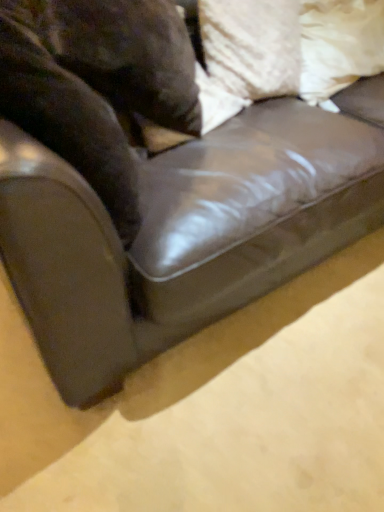
Find the location of a particular element. Image resolution: width=384 pixels, height=512 pixels. white fabric pillow at upper right, which is the first pillow in right-to-left order is located at coordinates click(x=339, y=45).

The height and width of the screenshot is (512, 384). What are the coordinates of `white fabric pillow at upper right, which is the first pillow in right-to-left order` in the screenshot? It's located at (339, 45).

From the image's perspective, is white fabric pillow at upper right, the 2th pillow when ordered from left to right, over white textured pillow at upper right, the 1th pillow when ordered from left to right?

Indeed, from the image's perspective, white fabric pillow at upper right, the 2th pillow when ordered from left to right, is shown above white textured pillow at upper right, the 1th pillow when ordered from left to right.

Can you confirm if white fabric pillow at upper right, the 2th pillow when ordered from left to right, is positioned to the left of white textured pillow at upper right, acting as the second pillow starting from the right?

In fact, white fabric pillow at upper right, the 2th pillow when ordered from left to right, is to the right of white textured pillow at upper right, acting as the second pillow starting from the right.

Does point (310, 59) lie behind point (209, 19)?

Yes, point (310, 59) is farther from viewer.

This screenshot has width=384, height=512. What are the coordinates of `pillow above the white textured pillow at upper right, acting as the second pillow starting from the right (from the image's perspective)` in the screenshot? It's located at (339, 45).

Considering the relative sizes of white textured pillow at upper right, the 1th pillow when ordered from left to right, and brown fur at left in the image provided, is white textured pillow at upper right, the 1th pillow when ordered from left to right, shorter than brown fur at left?

Yes.

Considering the relative sizes of white textured pillow at upper right, acting as the second pillow starting from the right, and brown fur at left in the image provided, is white textured pillow at upper right, acting as the second pillow starting from the right, smaller than brown fur at left?

Indeed, white textured pillow at upper right, acting as the second pillow starting from the right, has a smaller size compared to brown fur at left.

Which object is thinner, white textured pillow at upper right, the 1th pillow when ordered from left to right, or brown fur at left?

With smaller width is white textured pillow at upper right, the 1th pillow when ordered from left to right.

From the image's perspective, which one is positioned higher, white textured pillow at upper right, the 1th pillow when ordered from left to right, or brown fur at left?

white textured pillow at upper right, the 1th pillow when ordered from left to right, is shown above in the image.

Is brown fur at left turned away from white fabric pillow at upper right, the 2th pillow when ordered from left to right?

→ No, white fabric pillow at upper right, the 2th pillow when ordered from left to right, is not at the back of brown fur at left.

Do you think brown fur at left is within white fabric pillow at upper right, the 2th pillow when ordered from left to right, or outside of it?

brown fur at left is not inside white fabric pillow at upper right, the 2th pillow when ordered from left to right, it's outside.

From a real-world perspective, is brown fur at left under white fabric pillow at upper right, which is the first pillow in right-to-left order?

Incorrect, from a real-world perspective, brown fur at left is higher than white fabric pillow at upper right, which is the first pillow in right-to-left order.

Does brown fur at left have a lesser width compared to white fabric pillow at upper right, the 2th pillow when ordered from left to right?

Indeed, brown fur at left has a lesser width compared to white fabric pillow at upper right, the 2th pillow when ordered from left to right.

Considering the points (63, 0) and (216, 25), which point is in front, point (63, 0) or point (216, 25)?

The point (63, 0) is in front.

Between brown fur at left and white textured pillow at upper right, the 1th pillow when ordered from left to right, which one has less height?

Standing shorter between the two is white textured pillow at upper right, the 1th pillow when ordered from left to right.

From the image's perspective, who appears lower, brown fur at left or white textured pillow at upper right, the 1th pillow when ordered from left to right?

brown fur at left.

Does brown fur at left contain white textured pillow at upper right, the 1th pillow when ordered from left to right?

No, white textured pillow at upper right, the 1th pillow when ordered from left to right, is located outside of brown fur at left.

Considering the relative sizes of white fabric pillow at upper right, which is the first pillow in right-to-left order, and brown fur at left in the image provided, is white fabric pillow at upper right, which is the first pillow in right-to-left order, shorter than brown fur at left?

Indeed, white fabric pillow at upper right, which is the first pillow in right-to-left order, has a lesser height compared to brown fur at left.

Who is bigger, white fabric pillow at upper right, which is the first pillow in right-to-left order, or brown fur at left?

Bigger between the two is brown fur at left.

From the image's perspective, is white fabric pillow at upper right, which is the first pillow in right-to-left order, positioned above or below brown fur at left?

Based on their image positions, white fabric pillow at upper right, which is the first pillow in right-to-left order, is located above brown fur at left.

Considering the points (321, 75) and (65, 57), which point is in front, point (321, 75) or point (65, 57)?

The point (65, 57) is closer to the camera.

Considering the points (256, 87) and (362, 33), which point is behind, point (256, 87) or point (362, 33)?

The point (362, 33) is more distant.

Is the position of white textured pillow at upper right, the 1th pillow when ordered from left to right, less distant than that of white fabric pillow at upper right, which is the first pillow in right-to-left order?

Yes, the depth of white textured pillow at upper right, the 1th pillow when ordered from left to right, is less than that of white fabric pillow at upper right, which is the first pillow in right-to-left order.

From a real-world perspective, is white textured pillow at upper right, acting as the second pillow starting from the right, located higher than white fabric pillow at upper right, the 2th pillow when ordered from left to right?

Indeed, from a real-world perspective, white textured pillow at upper right, acting as the second pillow starting from the right, stands above white fabric pillow at upper right, the 2th pillow when ordered from left to right.

At what (x,y) coordinates should I click in order to perform the action: click on pillow in front of the white fabric pillow at upper right, the 2th pillow when ordered from left to right. Please return your answer as a coordinate pair (x, y). This screenshot has width=384, height=512. Looking at the image, I should click on (252, 46).

At what (x,y) coordinates should I click in order to perform the action: click on animal below the white textured pillow at upper right, the 1th pillow when ordered from left to right (from the image's perspective). Please return your answer as a coordinate pair (x, y). This screenshot has height=512, width=384. Looking at the image, I should click on (x=97, y=85).

From the image, which object appears to be nearer to white fabric pillow at upper right, the 2th pillow when ordered from left to right, brown fur at left or white textured pillow at upper right, acting as the second pillow starting from the right?

white textured pillow at upper right, acting as the second pillow starting from the right.

Which object lies further to the anchor point white fabric pillow at upper right, the 2th pillow when ordered from left to right, white textured pillow at upper right, acting as the second pillow starting from the right, or brown fur at left?

brown fur at left.

Which object lies further to the anchor point white textured pillow at upper right, the 1th pillow when ordered from left to right, white fabric pillow at upper right, which is the first pillow in right-to-left order, or brown fur at left?

Among the two, brown fur at left is located further to white textured pillow at upper right, the 1th pillow when ordered from left to right.

From the image, which object appears to be farther from brown fur at left, white fabric pillow at upper right, which is the first pillow in right-to-left order, or white textured pillow at upper right, acting as the second pillow starting from the right?

white fabric pillow at upper right, which is the first pillow in right-to-left order, lies further to brown fur at left than the other object.

From the image, which object appears to be farther from white textured pillow at upper right, acting as the second pillow starting from the right, brown fur at left or white fabric pillow at upper right, which is the first pillow in right-to-left order?

The object further to white textured pillow at upper right, acting as the second pillow starting from the right, is brown fur at left.

Looking at the image, which one is located further to brown fur at left, white textured pillow at upper right, acting as the second pillow starting from the right, or white fabric pillow at upper right, the 2th pillow when ordered from left to right?

Among the two, white fabric pillow at upper right, the 2th pillow when ordered from left to right, is located further to brown fur at left.

In order to click on pillow situated between brown fur at left and white fabric pillow at upper right, the 2th pillow when ordered from left to right, from left to right in this screenshot , I will do `click(252, 46)`.